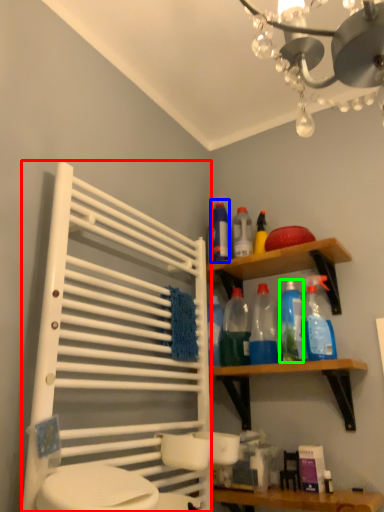
Question: Which object is positioned closest to cabinet (highlighted by a red box)? Select from cleaning product (highlighted by a blue box) and cleaning product (highlighted by a green box).

Choices:
 (A) cleaning product
 (B) cleaning product

Answer: (B)